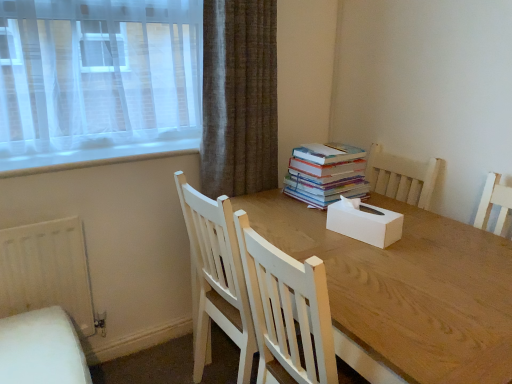
Question: Should I look upward or downward to see wooden table at center?

Choices:
 (A) up
 (B) down

Answer: (B)

Question: Is multicolored paper book at center surrounded by wooden table at center?

Choices:
 (A) yes
 (B) no

Answer: (B)

Question: Is wooden table at center far away from multicolored paper book at center?

Choices:
 (A) yes
 (B) no

Answer: (B)

Question: Is wooden table at center next to multicolored paper book at center?

Choices:
 (A) yes
 (B) no

Answer: (B)

Question: From a real-world perspective, does wooden table at center sit lower than multicolored paper book at center?

Choices:
 (A) no
 (B) yes

Answer: (B)

Question: Does wooden table at center have a greater height compared to multicolored paper book at center?

Choices:
 (A) no
 (B) yes

Answer: (B)

Question: Is wooden table at center thinner than multicolored paper book at center?

Choices:
 (A) no
 (B) yes

Answer: (A)

Question: Is white cardboard tissue box at center shorter than multicolored paper book at center?

Choices:
 (A) yes
 (B) no

Answer: (A)

Question: Is white cardboard tissue box at center smaller than multicolored paper book at center?

Choices:
 (A) no
 (B) yes

Answer: (B)

Question: From the image's perspective, is white cardboard tissue box at center under multicolored paper book at center?

Choices:
 (A) yes
 (B) no

Answer: (A)

Question: Are white cardboard tissue box at center and multicolored paper book at center beside each other?

Choices:
 (A) no
 (B) yes

Answer: (A)

Question: Does white cardboard tissue box at center come behind multicolored paper book at center?

Choices:
 (A) yes
 (B) no

Answer: (B)

Question: Considering the relative sizes of white cardboard tissue box at center and multicolored paper book at center in the image provided, is white cardboard tissue box at center taller than multicolored paper book at center?

Choices:
 (A) yes
 (B) no

Answer: (B)

Question: Is wooden table at center inside white cardboard tissue box at center?

Choices:
 (A) no
 (B) yes

Answer: (A)